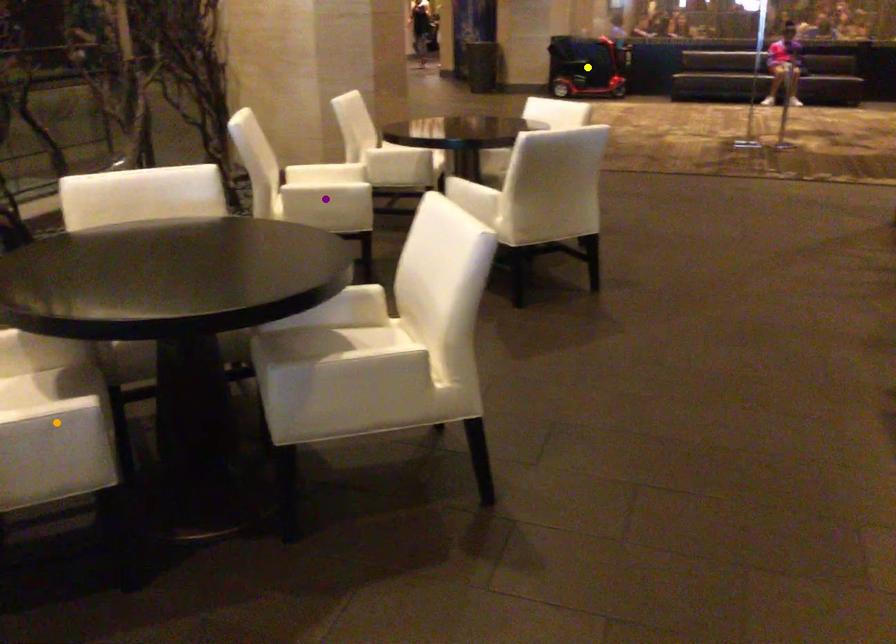
Order these from nearest to farthest:
yellow point, purple point, orange point

1. yellow point
2. purple point
3. orange point